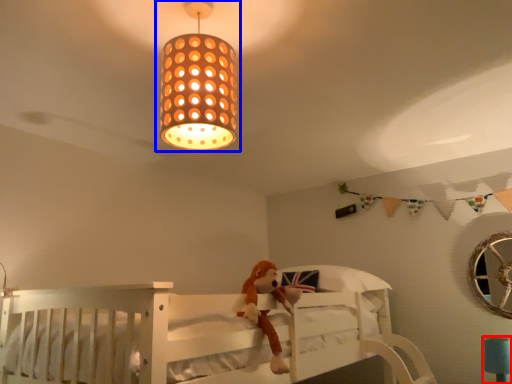
Question: Which object is further to the camera taking this photo, table lamp (highlighted by a red box) or lamp (highlighted by a blue box)?

Choices:
 (A) table lamp
 (B) lamp

Answer: (A)